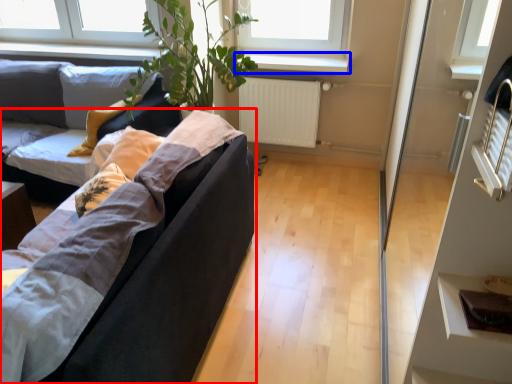
Question: Which object appears farthest to the camera in this image, studio couch (highlighted by a red box) or window sill (highlighted by a blue box)?

Choices:
 (A) studio couch
 (B) window sill

Answer: (B)